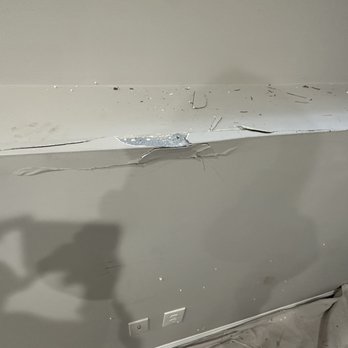
The image size is (348, 348). Find the location of `outlet`. outlet is located at coordinates (174, 327).